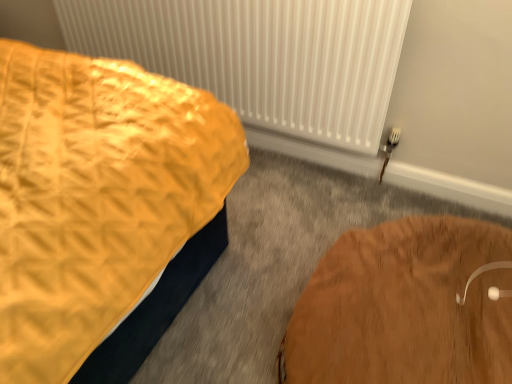
Where is `white textured radiator at upper center`? The height and width of the screenshot is (384, 512). white textured radiator at upper center is located at coordinates (262, 56).

Describe the element at coordinates (262, 56) in the screenshot. The image size is (512, 384). I see `white textured radiator at upper center` at that location.

This screenshot has height=384, width=512. Describe the element at coordinates (406, 307) in the screenshot. I see `brown wooden table at lower right` at that location.

Locate an element on the screen. brown wooden table at lower right is located at coordinates (406, 307).

Where is `white textured radiator at upper center`? white textured radiator at upper center is located at coordinates (262, 56).

Based on their positions, is white textured radiator at upper center located to the left or right of brown wooden table at lower right?

Clearly, white textured radiator at upper center is on the left of brown wooden table at lower right in the image.

Is white textured radiator at upper center further to camera compared to brown wooden table at lower right?

That is True.

Which is closer, [352,76] or [413,314]?

The point [413,314] is closer.

From the image's perspective, is white textured radiator at upper center beneath brown wooden table at lower right?

Incorrect, from the image's perspective, white textured radiator at upper center is higher than brown wooden table at lower right.

From a real-world perspective, is white textured radiator at upper center located higher than brown wooden table at lower right?

Correct, in the physical world, white textured radiator at upper center is higher than brown wooden table at lower right.

Which object is wider, white textured radiator at upper center or brown wooden table at lower right?

brown wooden table at lower right is wider.

Considering the sizes of objects white textured radiator at upper center and brown wooden table at lower right in the image provided, who is taller, white textured radiator at upper center or brown wooden table at lower right?

Standing taller between the two is white textured radiator at upper center.

Which of these two, white textured radiator at upper center or brown wooden table at lower right, is smaller?

white textured radiator at upper center is smaller.

Is brown wooden table at lower right located within white textured radiator at upper center?

Actually, brown wooden table at lower right is outside white textured radiator at upper center.

Are white textured radiator at upper center and brown wooden table at lower right located far from each other?

They are positioned close to each other.

Based on the photo, could you tell me if white textured radiator at upper center is facing brown wooden table at lower right?

Yes, white textured radiator at upper center is aimed at brown wooden table at lower right.

What's the angular difference between white textured radiator at upper center and brown wooden table at lower right's facing directions?

The angular difference between white textured radiator at upper center and brown wooden table at lower right is 90 degrees.

Locate an element on the screen. This screenshot has width=512, height=384. radiator to the left of brown wooden table at lower right is located at coordinates (x=262, y=56).

Does brown wooden table at lower right appear on the left side of white textured radiator at upper center?

No.

Considering their positions, is brown wooden table at lower right located in front of or behind white textured radiator at upper center?

brown wooden table at lower right is positioned closer to the viewer than white textured radiator at upper center.

Does point (311, 330) come closer to viewer compared to point (214, 18)?

Yes, it is.

From the image's perspective, is brown wooden table at lower right above or below white textured radiator at upper center?

brown wooden table at lower right is situated lower than white textured radiator at upper center in the image.

From a real-world perspective, is brown wooden table at lower right above or below white textured radiator at upper center?

From a real-world perspective, brown wooden table at lower right is physically below white textured radiator at upper center.

In the scene shown: Between brown wooden table at lower right and white textured radiator at upper center, which one has smaller width?

white textured radiator at upper center.

Between brown wooden table at lower right and white textured radiator at upper center, which one has less height?

With less height is brown wooden table at lower right.

Which of these two, brown wooden table at lower right or white textured radiator at upper center, is bigger?

With larger size is brown wooden table at lower right.

Could white textured radiator at upper center be considered to be inside brown wooden table at lower right?

Definitely not — white textured radiator at upper center is not inside brown wooden table at lower right.

Are brown wooden table at lower right and white textured radiator at upper center far apart?

No.

Is brown wooden table at lower right positioned with its back to white textured radiator at upper center?

No, white textured radiator at upper center is not at the back of brown wooden table at lower right.

How distant is brown wooden table at lower right from white textured radiator at upper center?

30.97 inches.

Where is `radiator on the left of brown wooden table at lower right`? The height and width of the screenshot is (384, 512). radiator on the left of brown wooden table at lower right is located at coordinates (262, 56).

The width and height of the screenshot is (512, 384). Identify the location of furniture located on the right of white textured radiator at upper center. (406, 307).

The width and height of the screenshot is (512, 384). I want to click on radiator lying above the brown wooden table at lower right (from the image's perspective), so click(262, 56).